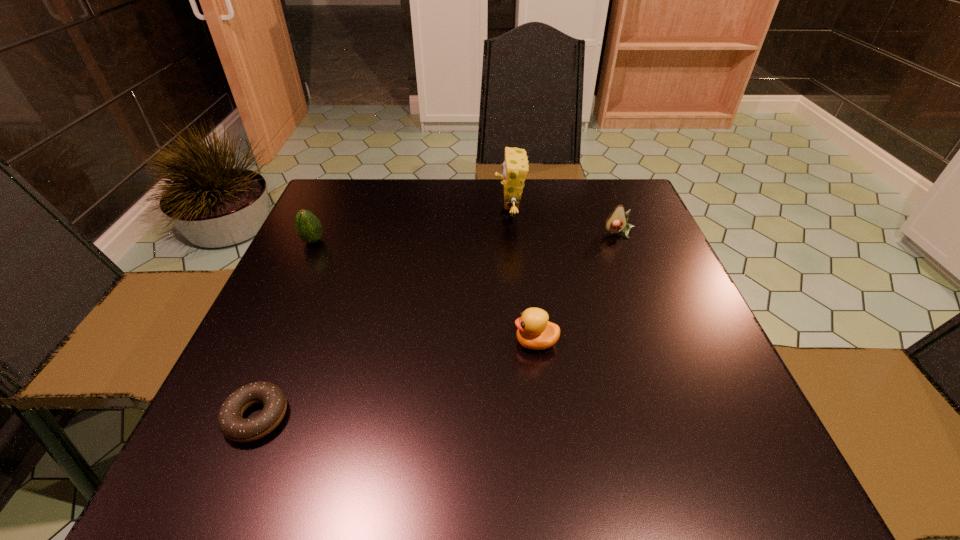
What are the coordinates of `vacant area in the image that satisfies the following two spatial constraints: 1. on the face of the tallest object; 2. on the front side of the left avocado` in the screenshot? It's located at (511, 241).